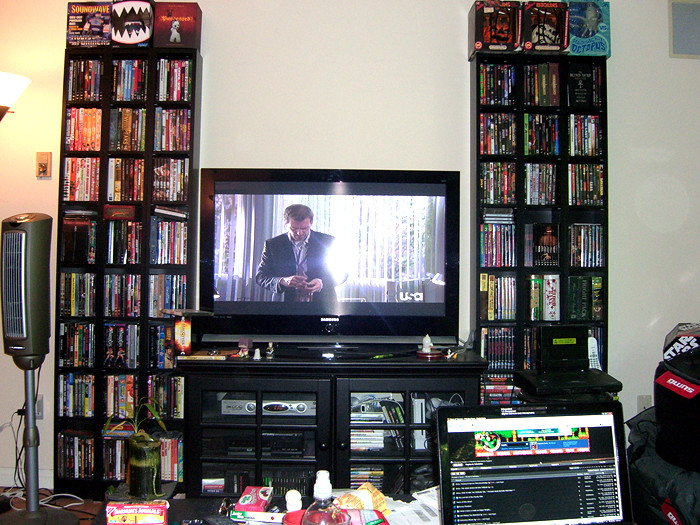
Locate an element on the screen. This screenshot has height=525, width=700. screen of computer is located at coordinates (525, 430).